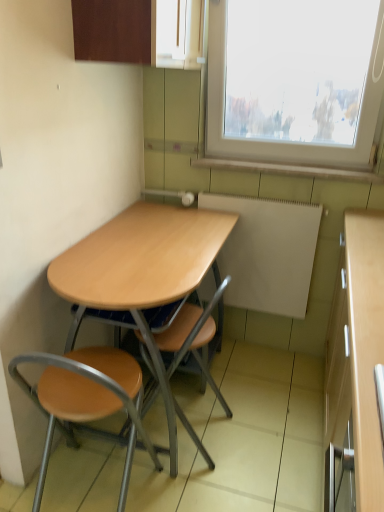
Question: From the image's perspective, is wooden seat at center, placed as the second chair when sorted from left to right, under matte wood cabinet at upper center?

Choices:
 (A) yes
 (B) no

Answer: (A)

Question: From the image's perspective, would you say wooden seat at center, which is the first chair from right to left, is positioned over matte wood cabinet at upper center?

Choices:
 (A) yes
 (B) no

Answer: (B)

Question: Are wooden seat at center, placed as the second chair when sorted from left to right, and matte wood cabinet at upper center located far from each other?

Choices:
 (A) no
 (B) yes

Answer: (B)

Question: Does wooden seat at center, placed as the second chair when sorted from left to right, turn towards matte wood cabinet at upper center?

Choices:
 (A) no
 (B) yes

Answer: (A)

Question: Does wooden seat at center, placed as the second chair when sorted from left to right, have a lesser width compared to matte wood cabinet at upper center?

Choices:
 (A) no
 (B) yes

Answer: (A)

Question: Is the depth of wooden seat at center, placed as the second chair when sorted from left to right, greater than that of matte wood cabinet at upper center?

Choices:
 (A) yes
 (B) no

Answer: (A)

Question: Is wooden seat at lower left, the second chair in the right-to-left sequence, located outside white matte radiator at center?

Choices:
 (A) no
 (B) yes

Answer: (B)

Question: Does wooden seat at lower left, the second chair in the right-to-left sequence, contain white matte radiator at center?

Choices:
 (A) no
 (B) yes

Answer: (A)

Question: Is wooden seat at lower left, the second chair in the right-to-left sequence, bigger than white matte radiator at center?

Choices:
 (A) no
 (B) yes

Answer: (B)

Question: Is wooden seat at lower left, the 1th chair positioned from the left, shorter than white matte radiator at center?

Choices:
 (A) yes
 (B) no

Answer: (B)

Question: Does wooden seat at lower left, the second chair in the right-to-left sequence, come behind white matte radiator at center?

Choices:
 (A) no
 (B) yes

Answer: (A)

Question: Is wooden seat at lower left, the second chair in the right-to-left sequence, placed right next to white matte radiator at center?

Choices:
 (A) yes
 (B) no

Answer: (B)

Question: From the image's perspective, does wooden seat at lower left, the 1th chair positioned from the left, appear lower than matte wood cabinet at upper center?

Choices:
 (A) no
 (B) yes

Answer: (B)